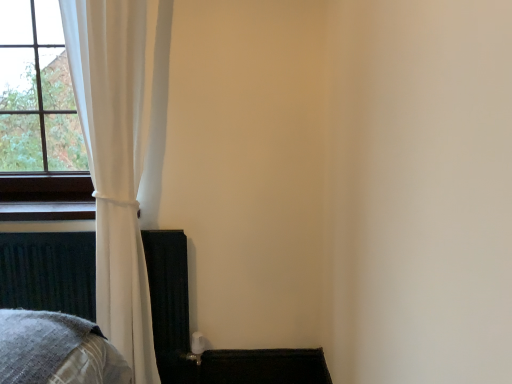
Question: Should I look upward or downward to see metallic dark gray bed frame at lower left?

Choices:
 (A) down
 (B) up

Answer: (A)

Question: Does metallic dark gray bed frame at lower left have a smaller size compared to white fabric curtain at left?

Choices:
 (A) yes
 (B) no

Answer: (A)

Question: Is metallic dark gray bed frame at lower left shorter than white fabric curtain at left?

Choices:
 (A) yes
 (B) no

Answer: (A)

Question: From the image's perspective, is metallic dark gray bed frame at lower left over white fabric curtain at left?

Choices:
 (A) yes
 (B) no

Answer: (B)

Question: From the image's perspective, does metallic dark gray bed frame at lower left appear lower than white fabric curtain at left?

Choices:
 (A) no
 (B) yes

Answer: (B)

Question: Does metallic dark gray bed frame at lower left come behind white fabric curtain at left?

Choices:
 (A) yes
 (B) no

Answer: (A)

Question: Can you confirm if metallic dark gray bed frame at lower left is thinner than white fabric curtain at left?

Choices:
 (A) yes
 (B) no

Answer: (A)

Question: Does white fabric curtain at left appear on the right side of metallic dark gray bed frame at lower left?

Choices:
 (A) yes
 (B) no

Answer: (A)

Question: Can you confirm if white fabric curtain at left is smaller than metallic dark gray bed frame at lower left?

Choices:
 (A) yes
 (B) no

Answer: (B)

Question: Considering the relative sizes of white fabric curtain at left and metallic dark gray bed frame at lower left in the image provided, is white fabric curtain at left wider than metallic dark gray bed frame at lower left?

Choices:
 (A) yes
 (B) no

Answer: (A)

Question: Considering the relative sizes of white fabric curtain at left and metallic dark gray bed frame at lower left in the image provided, is white fabric curtain at left shorter than metallic dark gray bed frame at lower left?

Choices:
 (A) no
 (B) yes

Answer: (A)

Question: Is white fabric curtain at left far from metallic dark gray bed frame at lower left?

Choices:
 (A) yes
 (B) no

Answer: (B)

Question: Does white fabric curtain at left touch metallic dark gray bed frame at lower left?

Choices:
 (A) no
 (B) yes

Answer: (A)

Question: Is point (176, 347) closer or farther from the camera than point (139, 236)?

Choices:
 (A) closer
 (B) farther

Answer: (B)